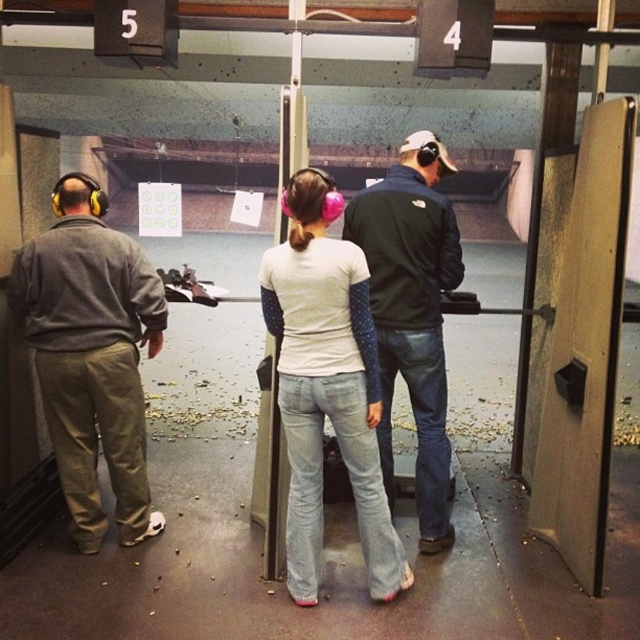
Question: Among these points, which one is farthest from the camera?

Choices:
 (A) (432, 440)
 (B) (83, 214)

Answer: (A)

Question: Is matte gray hoodie at left positioned at the back of dark blue jacket at center?

Choices:
 (A) no
 (B) yes

Answer: (B)

Question: Does matte gray hoodie at left have a lesser width compared to dark blue jacket at center?

Choices:
 (A) yes
 (B) no

Answer: (B)

Question: Does matte gray hoodie at left appear under dark blue jacket at center?

Choices:
 (A) no
 (B) yes

Answer: (B)

Question: Which of the following is the farthest from the observer?

Choices:
 (A) matte gray hoodie at left
 (B) dark blue jacket at center

Answer: (A)